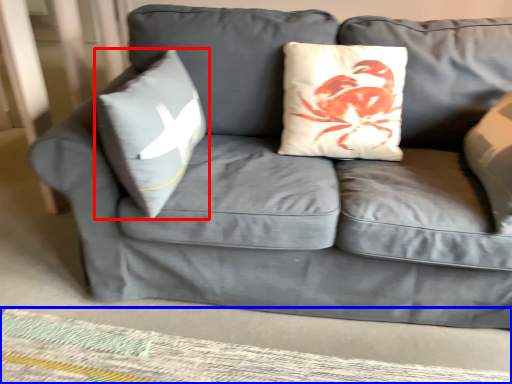
Question: Which of the following is the closest to the observer, pillow (highlighted by a red box) or mat (highlighted by a blue box)?

Choices:
 (A) pillow
 (B) mat

Answer: (A)